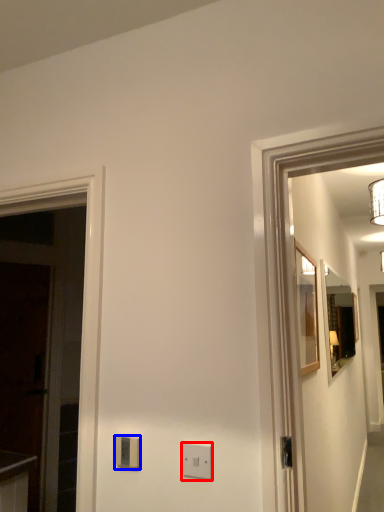
Question: Which of the following is the closest to the observer, light switch (highlighted by a red box) or light switch (highlighted by a blue box)?

Choices:
 (A) light switch
 (B) light switch

Answer: (A)